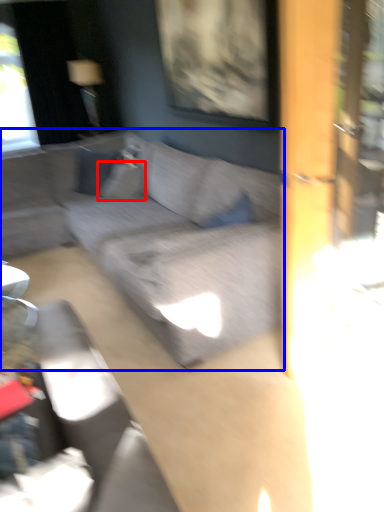
Question: Which object is further to the camera taking this photo, pillow (highlighted by a red box) or studio couch (highlighted by a blue box)?

Choices:
 (A) pillow
 (B) studio couch

Answer: (A)